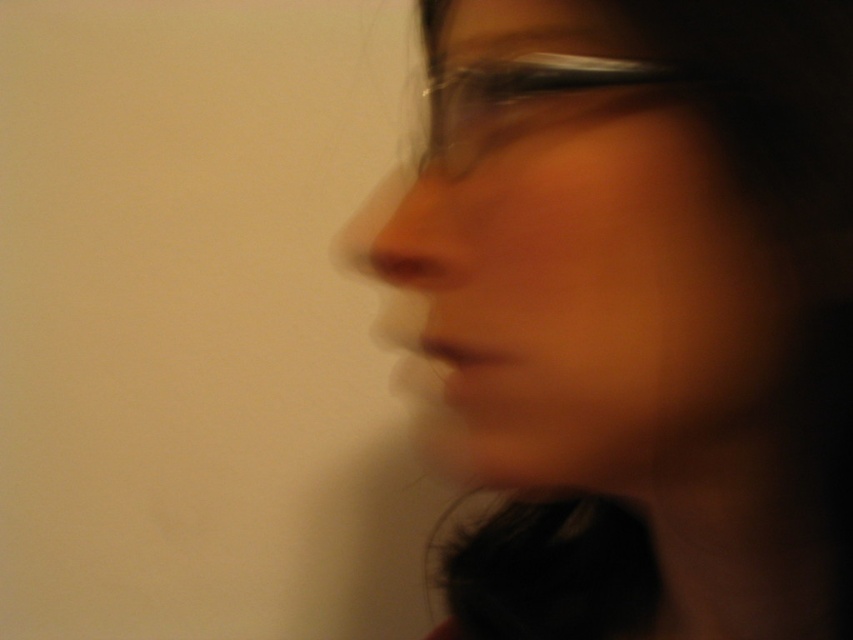
Question: Does smooth skin face at center have a smaller size compared to transparent plastic glasses at center?

Choices:
 (A) no
 (B) yes

Answer: (A)

Question: Can you confirm if smooth skin face at center is wider than transparent plastic glasses at center?

Choices:
 (A) no
 (B) yes

Answer: (B)

Question: Does smooth skin face at center appear on the right side of transparent plastic glasses at center?

Choices:
 (A) no
 (B) yes

Answer: (B)

Question: Which point appears closest to the camera in this image?

Choices:
 (A) (521, 74)
 (B) (436, 182)

Answer: (A)

Question: Which of the following is the closest to the observer?

Choices:
 (A) (485, 138)
 (B) (576, 314)

Answer: (B)